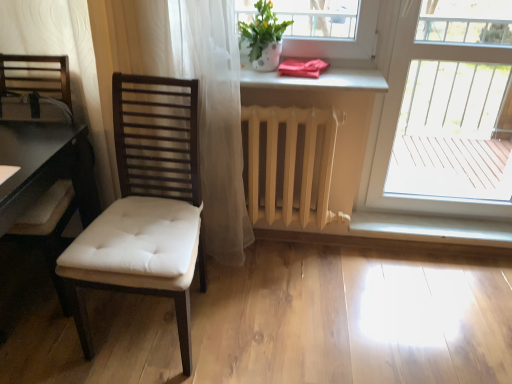
Question: Is white matte radiator at center bigger or smaller than matte white pot at upper center?

Choices:
 (A) big
 (B) small

Answer: (A)

Question: Is white matte radiator at center wider or thinner than matte white pot at upper center?

Choices:
 (A) wide
 (B) thin

Answer: (B)

Question: Which is farther from the matte white cushioned chair at left?

Choices:
 (A) matte white pot at upper center
 (B) transparent glass door at right
 (C) white matte radiator at center
 (D) red satin towel at upper center
 (E) white glossy window sill at lower center

Answer: (B)

Question: Which object is positioned farthest from the matte white pot at upper center?

Choices:
 (A) white glossy window sill at lower center
 (B) red satin towel at upper center
 (C) transparent glass door at right
 (D) matte white cushioned chair at left
 (E) white matte radiator at center

Answer: (C)